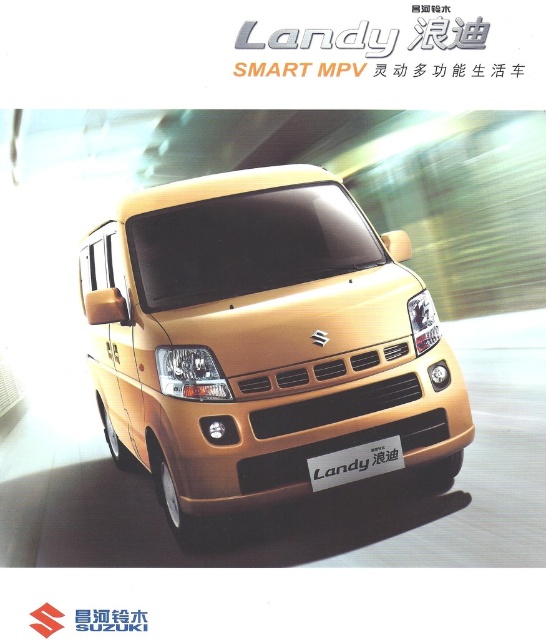
Question: Which point is closer to the camera?

Choices:
 (A) (324, 230)
 (B) (371, 458)

Answer: (B)

Question: Can you confirm if gold metallic van at center is positioned to the left of silver metallic plate at center?

Choices:
 (A) no
 (B) yes

Answer: (B)

Question: Is gold metallic van at center closer to camera compared to silver metallic plate at center?

Choices:
 (A) yes
 (B) no

Answer: (B)

Question: Does gold metallic van at center appear on the right side of silver metallic plate at center?

Choices:
 (A) yes
 (B) no

Answer: (B)

Question: Which point is farther to the camera?

Choices:
 (A) silver metallic plate at center
 (B) gold metallic van at center

Answer: (B)